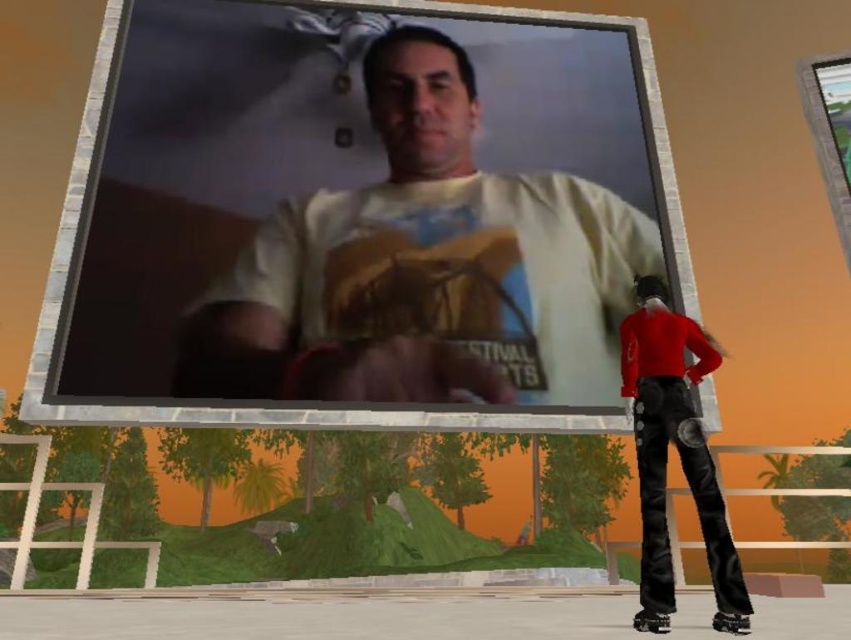
You are navigating a drone through a 3D model of this scene. You need to fly from point A to point B. If point A is at point (269,132) and point B is at point (700,456), which point should you start your flight from to ensure you are closer to the billboard?

You should start your flight from point A at point (269,132) because it is closer to the billboard than point B at point (700,456).

You are a photographer trying to capture a clear shot of the leather pants at lower right without the matte plastic billboard at center blocking the view. Is it possible to do so from your current position?

The matte plastic billboard at center is further to the viewer than the leather pants at lower right, so the billboard is closer to you and blocking the view of the leather pants at lower right. To capture a clear shot of the leather pants at lower right without the billboard blocking, you would need to move to a position where the billboard is no longer in front of the pants.